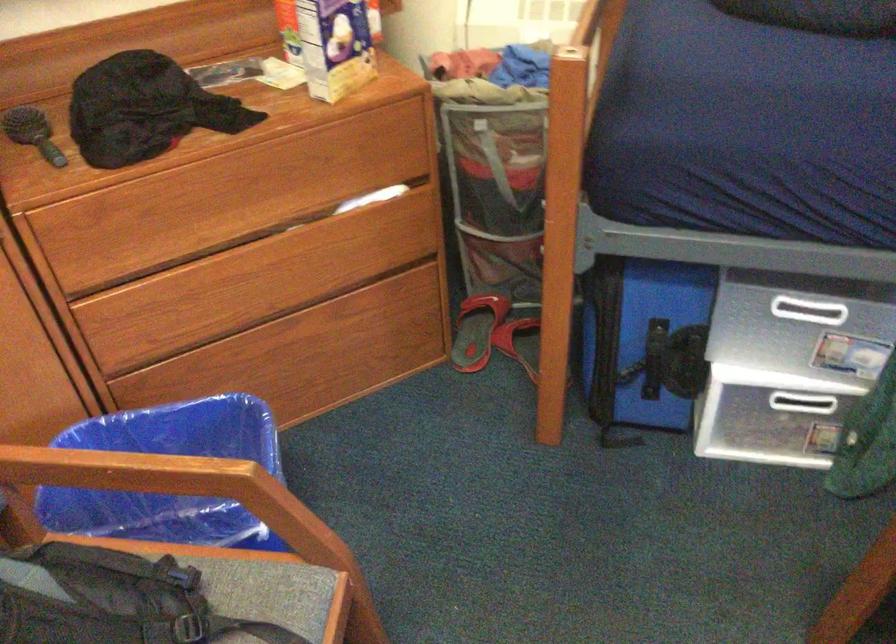
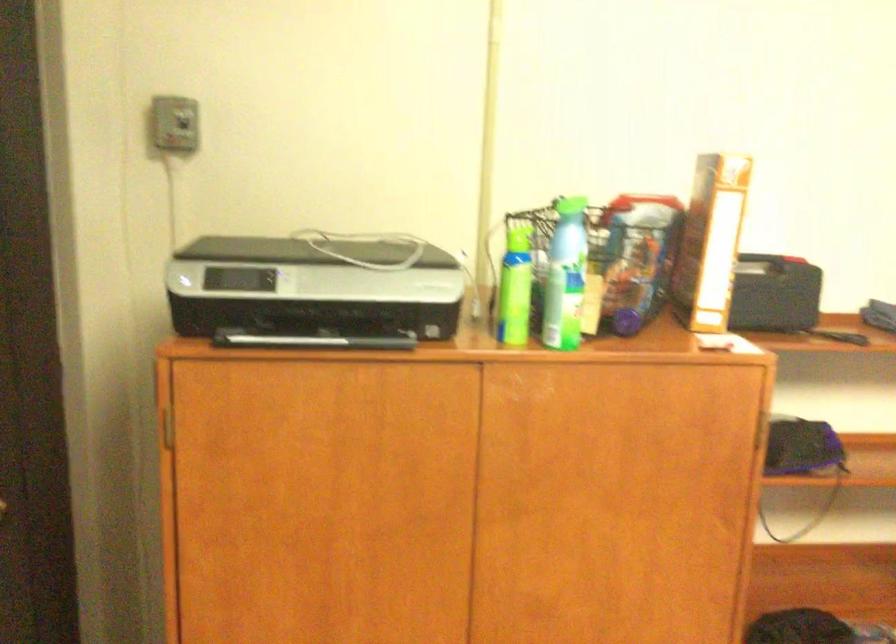
The images are taken continuously from a first-person perspective. In which direction is your viewpoint rotating?

The rotation direction of the camera is left-up.